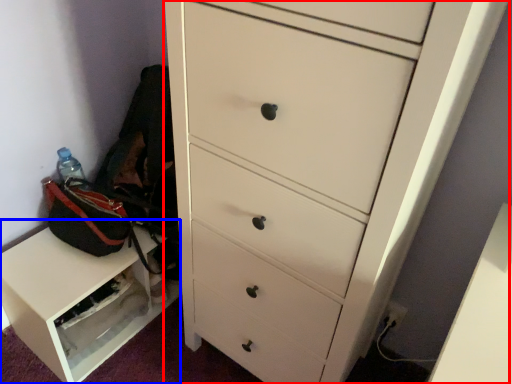
Question: Among these objects, which one is farthest to the camera, chest of drawers (highlighted by a red box) or cabinetry (highlighted by a blue box)?

Choices:
 (A) chest of drawers
 (B) cabinetry

Answer: (B)